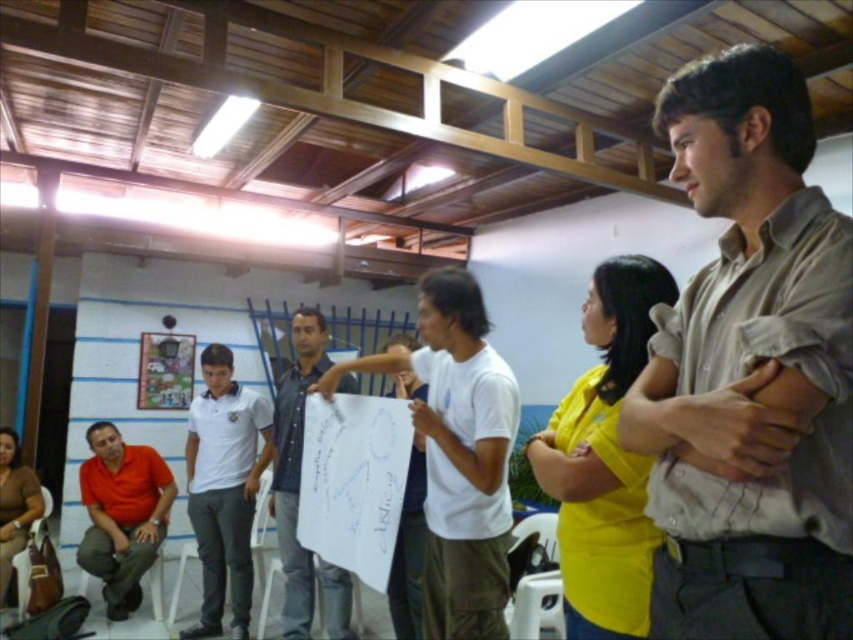
Question: Which point appears farthest from the camera in this image?

Choices:
 (A) (494, 490)
 (B) (809, 141)
 (C) (6, 467)
 (D) (210, 456)

Answer: (C)

Question: Does white matte t-shirt at center come behind white matte polo shirt at center?

Choices:
 (A) no
 (B) yes

Answer: (A)

Question: Among these objects, which one is farthest from the camera?

Choices:
 (A) light brown shirt at center
 (B) matte orange shirt at lower left
 (C) blue denim shirt at center
 (D) brown leather purse at lower left

Answer: (B)

Question: Is yellow matte shirt at center smaller than brown leather purse at lower left?

Choices:
 (A) yes
 (B) no

Answer: (A)

Question: Can you confirm if white matte t-shirt at center is bigger than white matte polo shirt at center?

Choices:
 (A) yes
 (B) no

Answer: (A)

Question: Which of these objects is positioned closest to the yellow matte shirt at center?

Choices:
 (A) white matte polo shirt at center
 (B) brown leather purse at lower left
 (C) matte orange shirt at lower left

Answer: (A)